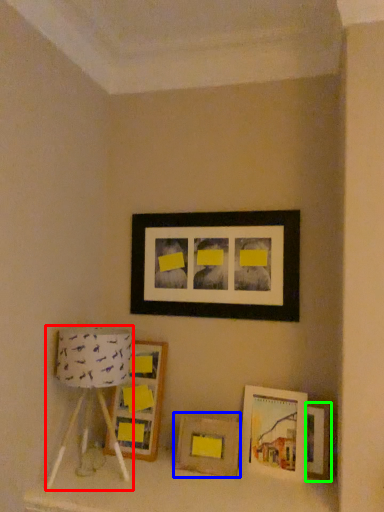
Question: Considering the real-world distances, which object is farthest from table lamp (highlighted by a red box)? picture frame (highlighted by a blue box) or picture frame (highlighted by a green box)?

Choices:
 (A) picture frame
 (B) picture frame

Answer: (B)